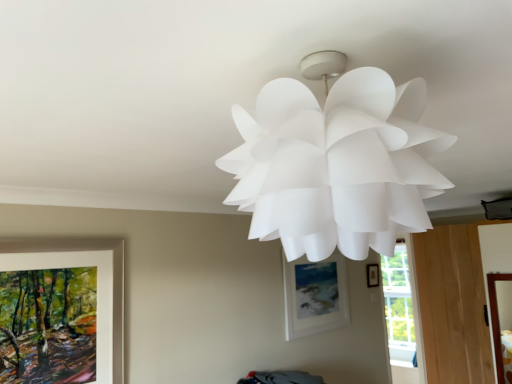
Question: From a real-world perspective, relative to wooden picture frame at lower left, acting as the first picture frame starting from the left, is white paper lamp at upper center vertically above or below?

Choices:
 (A) below
 (B) above

Answer: (B)

Question: Considering the positions of white paper lamp at upper center and wooden picture frame at lower left, which is counted as the 3th picture frame, starting from the right, in the image, is white paper lamp at upper center wider or thinner than wooden picture frame at lower left, which is counted as the 3th picture frame, starting from the right,?

Choices:
 (A) wide
 (B) thin

Answer: (A)

Question: Considering the real-world distances, which object is farthest from the white matte picture frame at center, the second picture frame viewed from the back?

Choices:
 (A) matte black picture frame at center-right, which is the 3th picture frame from left to right
 (B) wooden picture frame at lower left, acting as the first picture frame starting from the left
 (C) transparent glass window at lower right
 (D) white paper lamp at upper center

Answer: (D)

Question: Which is farther from the wooden picture frame at lower left, arranged as the 1th picture frame when viewed from the front?

Choices:
 (A) white paper lamp at upper center
 (B) matte black picture frame at center-right, which is the 3th picture frame from left to right
 (C) transparent glass window at lower right
 (D) white matte picture frame at center, which is the second picture frame in right-to-left order

Answer: (C)